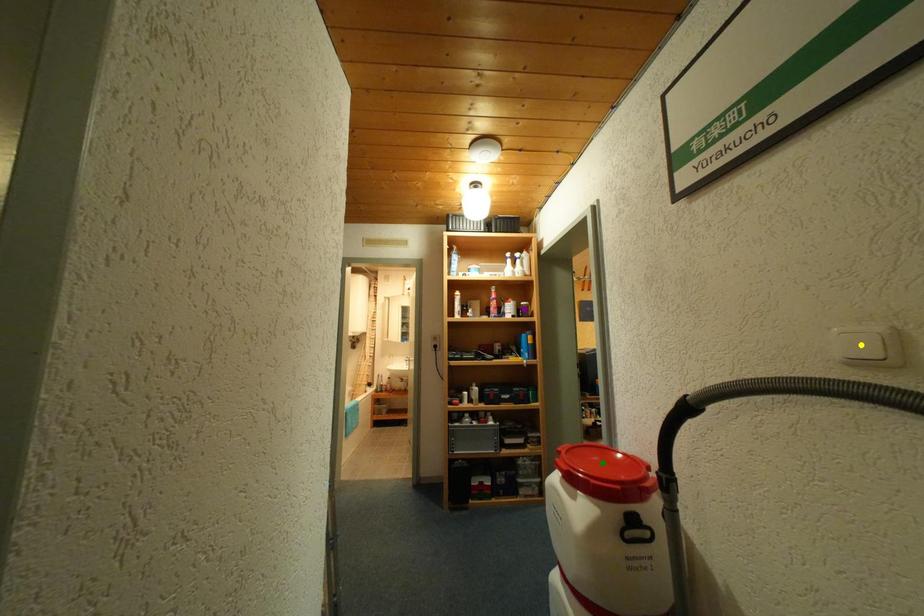
Order these from nearest to farthest:
green point | yellow point | purple point

1. yellow point
2. green point
3. purple point